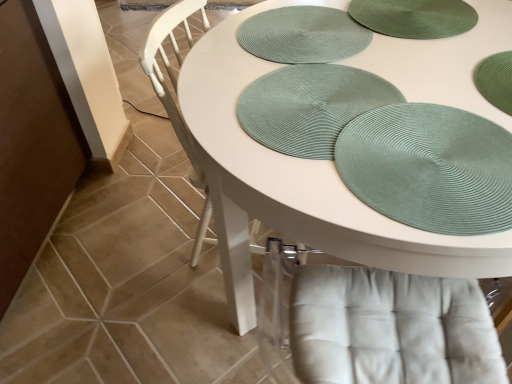
Identify the location of vacant space underneath green woven placemat at center, placed as the first platter when sorted from front to back (from a real-world perspective). Image resolution: width=512 pixels, height=384 pixels. (330, 123).